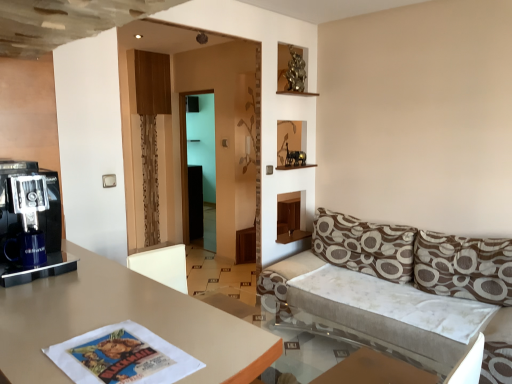
Question: Based on their sizes in the image, would you say matte beige table at center is bigger or smaller than transparent glass door at center?

Choices:
 (A) big
 (B) small

Answer: (A)

Question: Is matte beige table at center inside the boundaries of transparent glass door at center, or outside?

Choices:
 (A) outside
 (B) inside

Answer: (A)

Question: Which object is positioned farthest from the brown fabric armchair at lower right?

Choices:
 (A) matte black coffee machine at left
 (B) transparent glass door at center
 (C) white fabric couch at right
 (D) brown printed cushion at right, placed as the 2th pillow when sorted from right to left
 (E) matte beige table at center

Answer: (B)

Question: Which object is the farthest from the transparent glass door at center?

Choices:
 (A) matte beige table at center
 (B) white fabric couch at right
 (C) brown fabric armchair at lower right
 (D) brown printed cushion at right, placed as the 2th pillow when sorted from right to left
 (E) matte black coffee machine at left

Answer: (A)